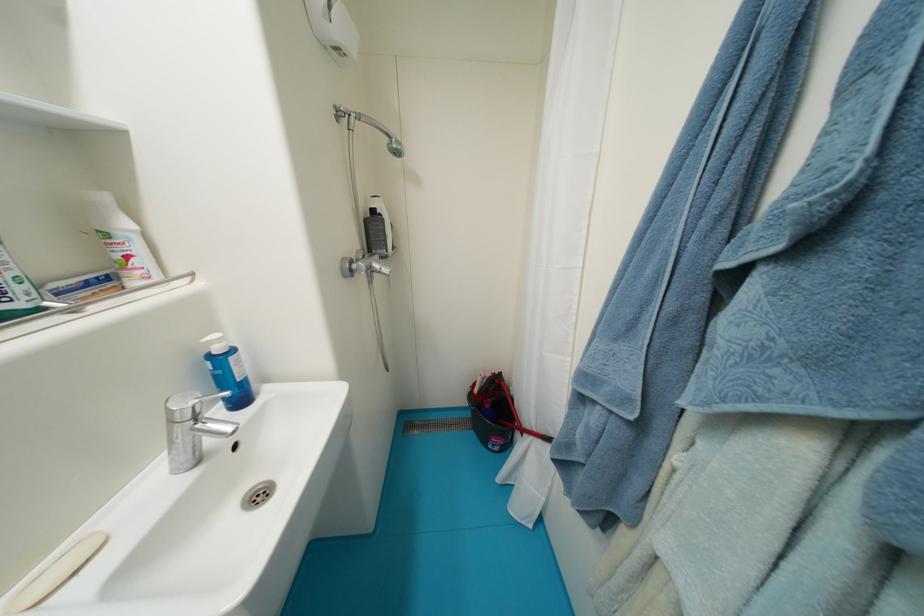
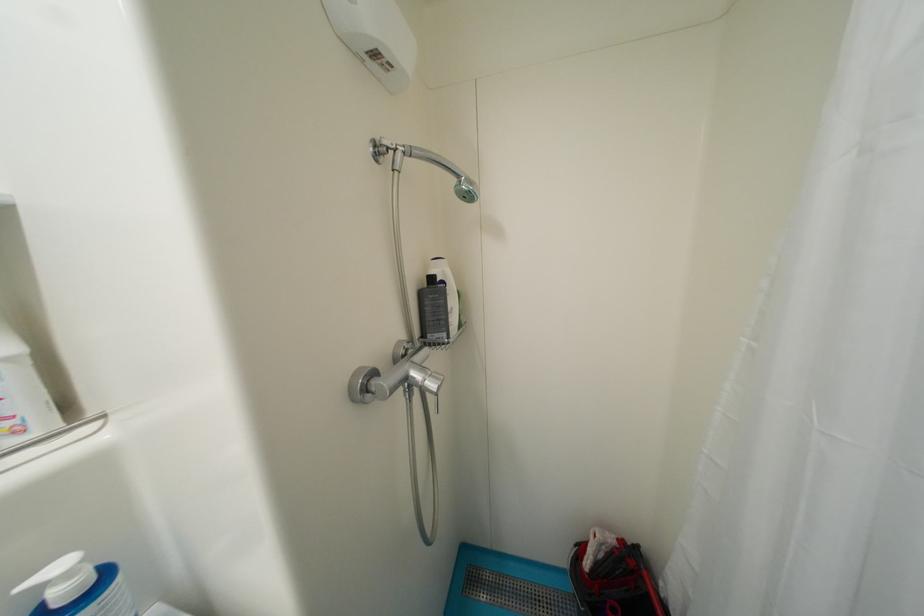
The point at (x=380, y=214) is marked in the first image. Where is the corresponding point in the second image?

(439, 281)